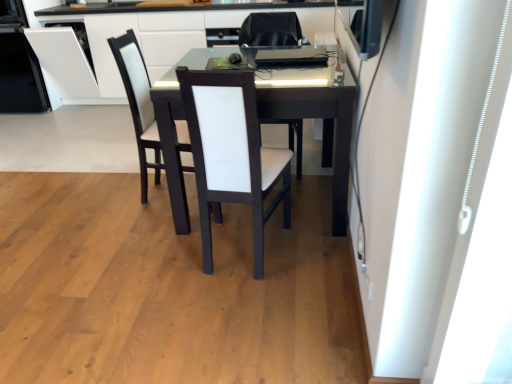
Locate an element on the screen. free space in front of white leather chair at center, the first chair in the front-to-back sequence is located at coordinates (241, 302).